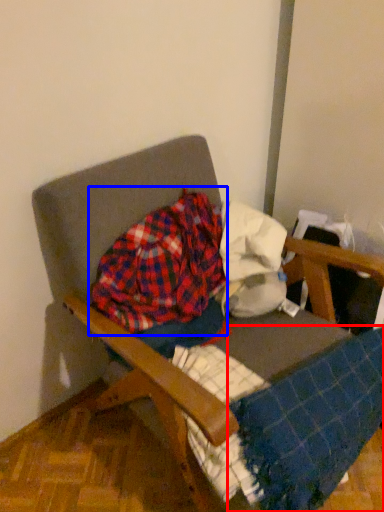
Question: Which object is closer to the camera taking this photo, blanket (highlighted by a red box) or flannel (highlighted by a blue box)?

Choices:
 (A) blanket
 (B) flannel

Answer: (A)